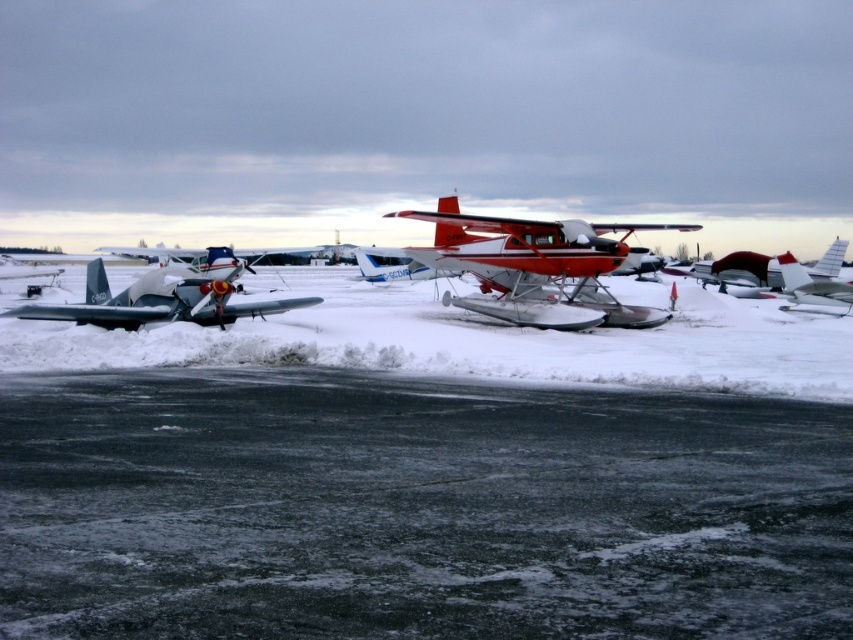
You are a pilot trying to determine which seaplane has a lower height for easier boarding. Based on the image, which one between the red polished aluminum seaplane at center and the matte black seaplane at center is shorter?

The red polished aluminum seaplane at center has a lesser height compared to matte black seaplane at center, so it is shorter and easier to board.